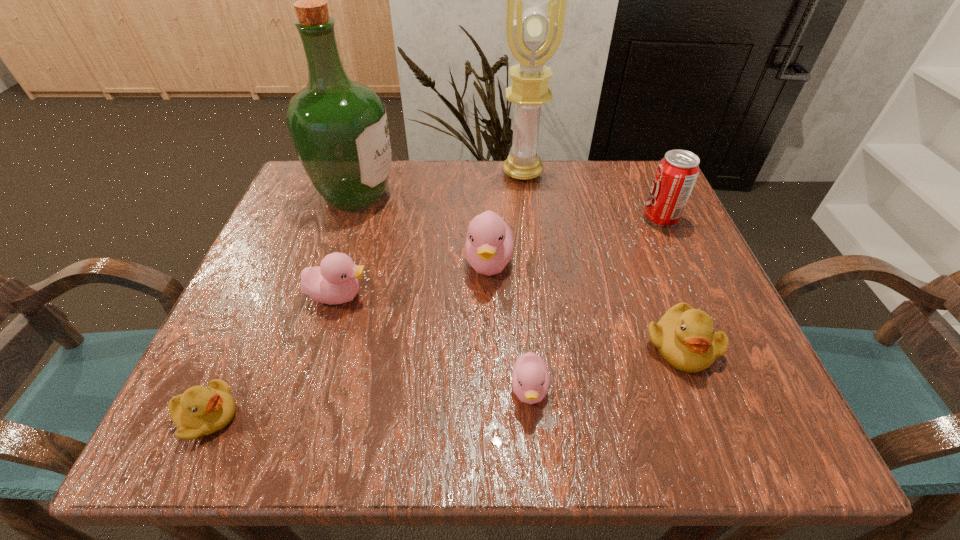
At what (x,y) coordinates should I click in order to perform the action: click on unoccupied area between the bigger yellow duckling and the nearer yellow duckling. Please return your answer as a coordinate pair (x, y). Image resolution: width=960 pixels, height=540 pixels. Looking at the image, I should click on (444, 381).

You are a GUI agent. You are given a task and a screenshot of the screen. Output one action in this format:
    pyautogui.click(x=<x>, y=<y>)
    Task: Click on the blank region between the bigger yellow duckling and the nearest pink duckling
    
    Given the screenshot: What is the action you would take?
    (x=605, y=368)

The image size is (960, 540). What are the coordinates of `object that is the seventh nearest to the left yellow duckling` in the screenshot? It's located at (676, 174).

Identify which object is located as the sixth nearest to the left yellow duckling. Please provide its 2D coordinates. Your answer should be formatted as a tuple, i.e. [(x, y)], where the tuple contains the x and y coordinates of a point satisfying the conditions above.

[(534, 34)]

At what (x,y) coordinates should I click in order to perform the action: click on duckling object that ranks as the third closest to the biggest pink duckling. Please return your answer as a coordinate pair (x, y). This screenshot has width=960, height=540. Looking at the image, I should click on (685, 337).

Find the location of a particular element. This screenshot has height=540, width=960. the third closest duckling to the award is located at coordinates (685, 337).

The image size is (960, 540). Find the location of `the closest pink duckling to the nearest pink duckling`. the closest pink duckling to the nearest pink duckling is located at coordinates (489, 244).

The height and width of the screenshot is (540, 960). Identify the location of pink duckling that is the second closest to the award. (335, 281).

Image resolution: width=960 pixels, height=540 pixels. I want to click on blank area in the image that satisfies the following two spatial constraints: 1. on the front-facing side of the liquor; 2. on the back side of the soda, so click(348, 219).

The image size is (960, 540). I want to click on free spot that satisfies the following two spatial constraints: 1. on the front-facing side of the smallest pink duckling; 2. on the front-facing side of the left yellow duckling, so click(532, 416).